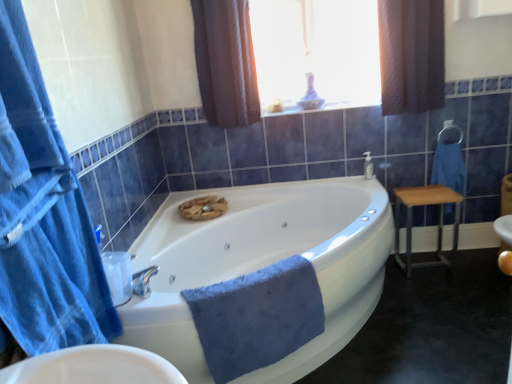
Describe the element at coordinates (257, 317) in the screenshot. I see `blue soft towel at center, the second bath towel viewed from the back` at that location.

The image size is (512, 384). I want to click on blue soft towel at center, marked as the first bath towel in a bottom-to-top arrangement, so click(257, 317).

What is the approximate height of blue cotton towel at right, arranged as the 2th bath towel when viewed from the front?

15.49 inches.

The width and height of the screenshot is (512, 384). What do you see at coordinates (316, 51) in the screenshot?
I see `translucent glass vase at upper center` at bounding box center [316, 51].

At what (x,y) coordinates should I click in order to perform the action: click on blue soft towel at center, which appears as the 1th bath towel when viewed from the left. Please return your answer as a coordinate pair (x, y). This screenshot has width=512, height=384. Looking at the image, I should click on (257, 317).

Between point (460, 150) and point (433, 50), which one is positioned in front?

The point (433, 50) is more forward.

Looking at this image, is blue cotton towel at right, the first bath towel viewed from the right, far from brown textured curtain at upper right, acting as the 1th curtain starting from the right?

blue cotton towel at right, the first bath towel viewed from the right, is near brown textured curtain at upper right, acting as the 1th curtain starting from the right, not far away.

Based on the photo, which is more to the left, blue cotton towel at right, which ranks as the first bath towel in top-to-bottom order, or brown textured curtain at upper right, which is counted as the second curtain, starting from the back?

brown textured curtain at upper right, which is counted as the second curtain, starting from the back, is more to the left.

Who is taller, blue cotton towel at right, the first bath towel viewed from the right, or brown textured curtain at upper right, placed as the third curtain when sorted from left to right?

With more height is brown textured curtain at upper right, placed as the third curtain when sorted from left to right.

Does brown textured curtain at upper center, which is counted as the second curtain, starting from the left, lie behind silver metallic faucet at upper right?

No, brown textured curtain at upper center, which is counted as the second curtain, starting from the left, is closer to the viewer.

In terms of height, does brown textured curtain at upper center, which is counted as the second curtain, starting from the left, look taller or shorter compared to silver metallic faucet at upper right?

Clearly, brown textured curtain at upper center, which is counted as the second curtain, starting from the left, is taller compared to silver metallic faucet at upper right.

Is brown textured curtain at upper center, which is counted as the second curtain, starting from the left, facing towards silver metallic faucet at upper right?

No.

Does brown textured curtain at upper center, which is counted as the second curtain, starting from the left, contain silver metallic faucet at upper right?

Actually, silver metallic faucet at upper right is outside brown textured curtain at upper center, which is counted as the second curtain, starting from the left.

Is silver metallic faucet at upper right far from brown textured curtain at upper center, which appears as the 2th curtain when viewed from the right?

silver metallic faucet at upper right is positioned a significant distance from brown textured curtain at upper center, which appears as the 2th curtain when viewed from the right.

Looking at this image, from a real-world perspective, relative to brown textured curtain at upper center, which is the third curtain from front to back, is silver metallic faucet at upper right vertically above or below?

In terms of real-world spatial position, silver metallic faucet at upper right is below brown textured curtain at upper center, which is the third curtain from front to back.

Who is shorter, silver metallic faucet at upper right or brown textured curtain at upper center, which is counted as the second curtain, starting from the left?

Standing shorter between the two is silver metallic faucet at upper right.

Considering the positions of point (367, 155) and point (236, 91), is point (367, 155) closer or farther from the camera than point (236, 91)?

Clearly, point (367, 155) is more distant from the camera than point (236, 91).

Does silver metallic faucet at upper right have a lesser width compared to wooden/metallic stool at right?

Correct, the width of silver metallic faucet at upper right is less than that of wooden/metallic stool at right.

From a real-world perspective, which object stands above the other?

In real-world perspective, silver metallic faucet at upper right is above.

Do you think silver metallic faucet at upper right is within wooden/metallic stool at right, or outside of it?

silver metallic faucet at upper right is located beyond the bounds of wooden/metallic stool at right.

Is silver metallic faucet at upper right facing towards wooden/metallic stool at right?

No.

Would you say blue fabric towel at left, which is the third curtain from right to left, is to the left or to the right of translucent glass vase at upper center in the picture?

blue fabric towel at left, which is the third curtain from right to left, is to the left of translucent glass vase at upper center.

Considering the relative sizes of blue fabric towel at left, the third curtain viewed from the back, and translucent glass vase at upper center in the image provided, is blue fabric towel at left, the third curtain viewed from the back, taller than translucent glass vase at upper center?

No, blue fabric towel at left, the third curtain viewed from the back, is not taller than translucent glass vase at upper center.

Is blue fabric towel at left, which ranks as the 1th curtain in front-to-back order, positioned with its back to translucent glass vase at upper center?

blue fabric towel at left, which ranks as the 1th curtain in front-to-back order, is not turned away from translucent glass vase at upper center.

Is blue fabric towel at left, the third curtain viewed from the back, inside or outside of translucent glass vase at upper center?

blue fabric towel at left, the third curtain viewed from the back, is outside translucent glass vase at upper center.

Looking at this image, between metallic silver towel bar at upper right and blue soft towel at center, acting as the 2th bath towel starting from the top, which one has smaller width?

With smaller width is metallic silver towel bar at upper right.

Considering the relative positions of metallic silver towel bar at upper right and blue soft towel at center, the second bath towel viewed from the back, in the image provided, is metallic silver towel bar at upper right to the right of blue soft towel at center, the second bath towel viewed from the back, from the viewer's perspective?

Yes, metallic silver towel bar at upper right is to the right of blue soft towel at center, the second bath towel viewed from the back.

How different are the orientations of metallic silver towel bar at upper right and blue soft towel at center, which appears as the 1th bath towel when viewed from the left, in degrees?

The angle between the facing direction of metallic silver towel bar at upper right and the facing direction of blue soft towel at center, which appears as the 1th bath towel when viewed from the left, is 28.6 degrees.

Which point is more forward, (x=461, y=137) or (x=269, y=292)?

The point (x=269, y=292) is in front.

Is point (445, 178) closer to camera compared to point (372, 175)?

Yes, it is in front of point (372, 175).

Would you say blue cotton towel at right, which is counted as the 2th bath towel, starting from the left, is outside silver metallic faucet at upper right?

Yes, blue cotton towel at right, which is counted as the 2th bath towel, starting from the left, is outside of silver metallic faucet at upper right.

Locate an element on the screen. The width and height of the screenshot is (512, 384). the 1st bath towel below when counting from the brown textured curtain at upper right, acting as the 1th curtain starting from the right (from the image's perspective) is located at coordinates (449, 167).

This screenshot has width=512, height=384. In order to click on faucet on the right of brown textured curtain at upper center, which ranks as the 1th curtain in back-to-front order in this screenshot , I will do (368, 166).

When comparing their distances from blue cotton towel at right, arranged as the 2th bath towel when viewed from the front, does brown textured curtain at upper right, which appears as the second curtain when viewed from the front, or silver metallic faucet at upper right seem closer?

silver metallic faucet at upper right.

Considering their positions, is wooden/metallic stool at right positioned further to blue soft towel at center, which appears as the 1th bath towel when viewed from the front, than blue cotton towel at right, which is the first bath towel in back-to-front order?

blue cotton towel at right, which is the first bath towel in back-to-front order.

Based on their spatial positions, is metallic silver towel bar at upper right or brown textured curtain at upper center, which ranks as the 1th curtain in back-to-front order, further from blue soft towel at center, which appears as the 1th bath towel when viewed from the left?

metallic silver towel bar at upper right is positioned further to the anchor blue soft towel at center, which appears as the 1th bath towel when viewed from the left.

In the scene shown: Looking at the image, which one is located further to blue soft towel at center, marked as the first bath towel in a bottom-to-top arrangement, white glossy bathtub at center or brown textured curtain at upper center, which is counted as the second curtain, starting from the left?

brown textured curtain at upper center, which is counted as the second curtain, starting from the left, is positioned further to the anchor blue soft towel at center, marked as the first bath towel in a bottom-to-top arrangement.

Estimate the real-world distances between objects in this image. Which object is closer to blue soft towel at center, marked as the first bath towel in a bottom-to-top arrangement, metallic silver towel bar at upper right or brown textured curtain at upper right, acting as the 1th curtain starting from the right?

brown textured curtain at upper right, acting as the 1th curtain starting from the right, is positioned closer to the anchor blue soft towel at center, marked as the first bath towel in a bottom-to-top arrangement.

Looking at this image, when comparing their distances from white glossy bathtub at center, does blue cotton towel at right, which ranks as the first bath towel in top-to-bottom order, or wooden/metallic stool at right seem closer?

The object closer to white glossy bathtub at center is wooden/metallic stool at right.

Considering their positions, is white glossy bathtub at center positioned closer to metallic silver towel bar at upper right than silver metallic faucet at upper right?

silver metallic faucet at upper right lies closer to metallic silver towel bar at upper right than the other object.

Considering their positions, is white glossy bathtub at center positioned further to blue fabric towel at left, positioned as the 1th curtain in left-to-right order, than brown textured curtain at upper right, which appears as the second curtain when viewed from the front?

Among the two, brown textured curtain at upper right, which appears as the second curtain when viewed from the front, is located further to blue fabric towel at left, positioned as the 1th curtain in left-to-right order.

Find the location of a particular element. towel bar located between brown textured curtain at upper center, which is the third curtain from front to back, and blue cotton towel at right, which is the first bath towel in back-to-front order, in the left-right direction is located at coordinates (450, 129).

This screenshot has width=512, height=384. Find the location of `faucet between brown textured curtain at upper right, acting as the 1th curtain starting from the right, and wooden/metallic stool at right in the up-down direction`. faucet between brown textured curtain at upper right, acting as the 1th curtain starting from the right, and wooden/metallic stool at right in the up-down direction is located at coordinates (368, 166).

In order to click on window between brown textured curtain at upper center, which is counted as the second curtain, starting from the left, and metallic silver towel bar at upper right in this screenshot , I will do `click(316, 51)`.

Locate an element on the screen. This screenshot has width=512, height=384. towel bar situated between blue soft towel at center, placed as the second bath towel when sorted from right to left, and blue cotton towel at right, marked as the second bath towel in a bottom-to-top arrangement, from left to right is located at coordinates (450, 129).